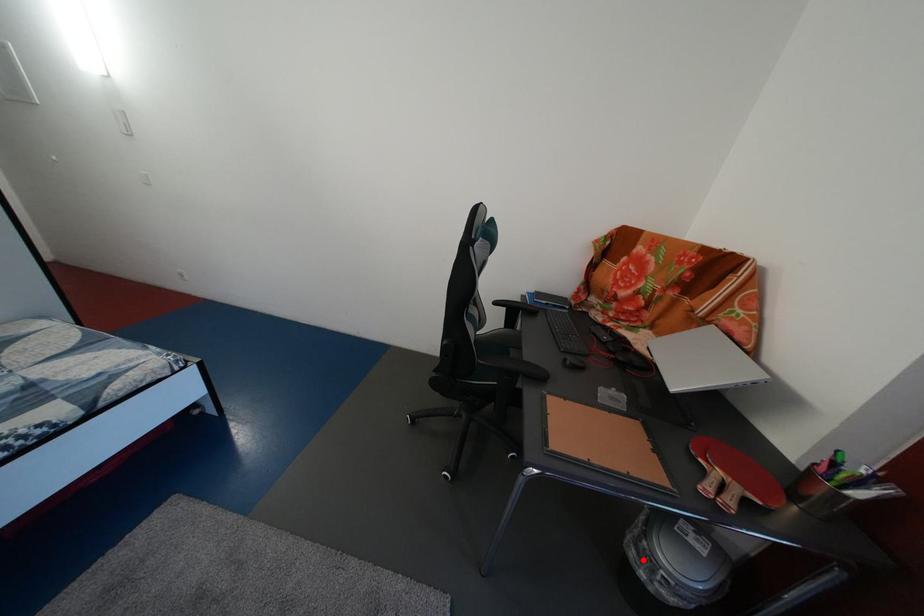
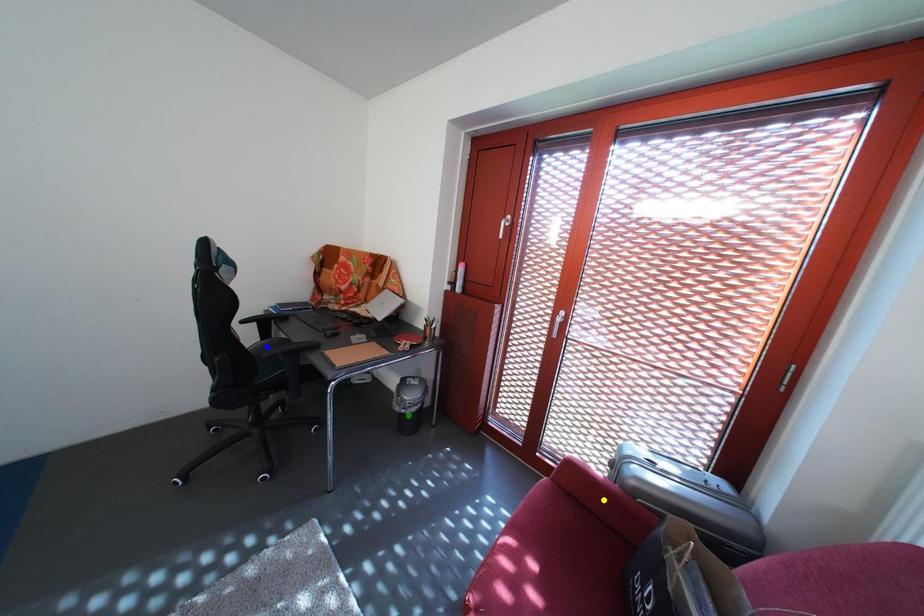
Question: I am providing you with two images of the same scene from different viewpoints. A red point is marked on the first image. You are given multiple points on the second image. Which mark in image 2 goes with the point in image 1?

Choices:
 (A) green point
 (B) yellow point
 (C) blue point

Answer: (A)